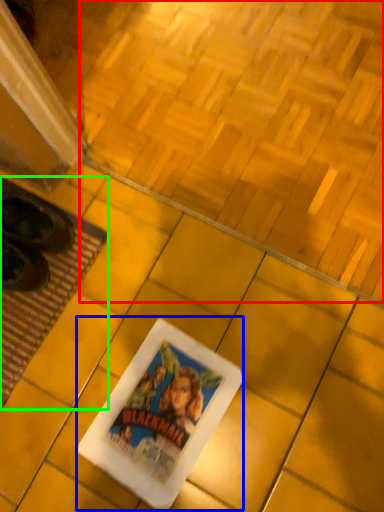
Question: Considering the real-world distances, which object is closest to square (highlighted by a red box)? movie poster (highlighted by a blue box) or mat (highlighted by a green box).

Choices:
 (A) movie poster
 (B) mat

Answer: (B)